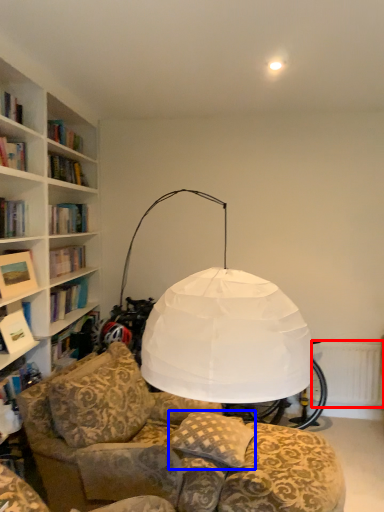
Question: Which object is closer to the camera taking this photo, radiator (highlighted by a red box) or pillow (highlighted by a blue box)?

Choices:
 (A) radiator
 (B) pillow

Answer: (B)